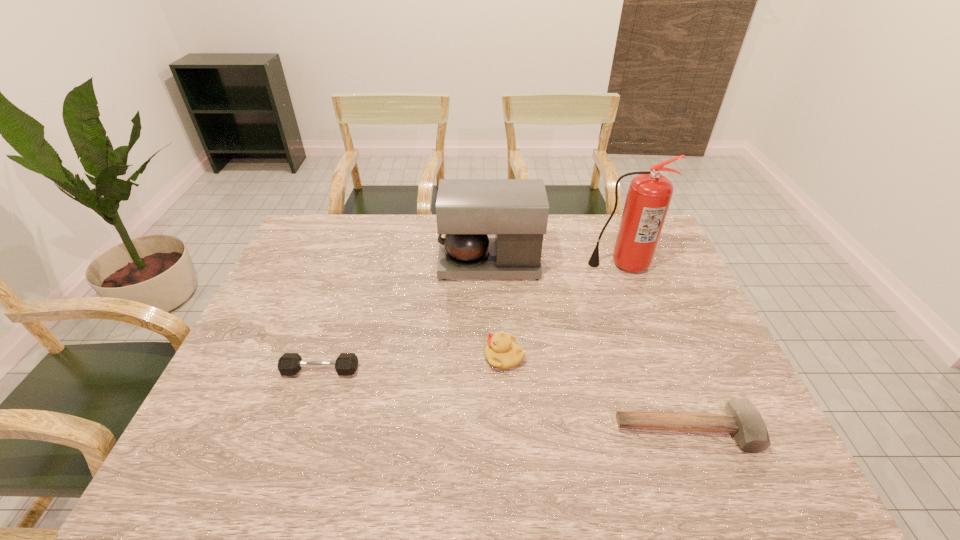
The height and width of the screenshot is (540, 960). Identify the location of vacant space located on the front-facing side of the third shortest object. (425, 357).

What are the coordinates of `vacant area situated on the front-facing side of the third shortest object` in the screenshot? It's located at (375, 357).

Identify the location of free space located 0.210m on the right of the dumbbell. (443, 371).

Locate an element on the screen. The width and height of the screenshot is (960, 540). free spot located 0.210m on the back of the nearest object is located at coordinates (652, 341).

You are a GUI agent. You are given a task and a screenshot of the screen. Output one action in this format:
    pyautogui.click(x=<x>, y=<y>)
    Task: Click on the fire extinguisher situated at the far edge
    Image resolution: width=960 pixels, height=540 pixels.
    Given the screenshot: What is the action you would take?
    pyautogui.click(x=649, y=195)

This screenshot has height=540, width=960. Find the location of `coffee maker positioned at the far edge`. coffee maker positioned at the far edge is located at coordinates (516, 210).

Where is `object that is at the near edge`? The height and width of the screenshot is (540, 960). object that is at the near edge is located at coordinates (742, 419).

Where is `object at the left edge`? This screenshot has width=960, height=540. object at the left edge is located at coordinates (289, 364).

This screenshot has height=540, width=960. I want to click on fire extinguisher that is positioned at the right edge, so click(x=649, y=195).

At what (x,y) coordinates should I click in order to perform the action: click on mallet present at the right edge. Please return your answer as a coordinate pair (x, y). Looking at the image, I should click on (742, 419).